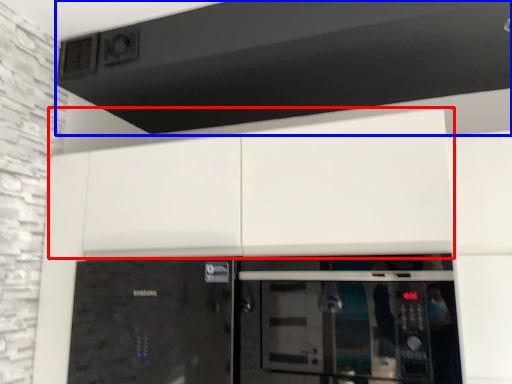
Question: Which point is further to the camera, cabinetry (highlighted by a red box) or exhaust hood (highlighted by a blue box)?

Choices:
 (A) cabinetry
 (B) exhaust hood

Answer: (B)